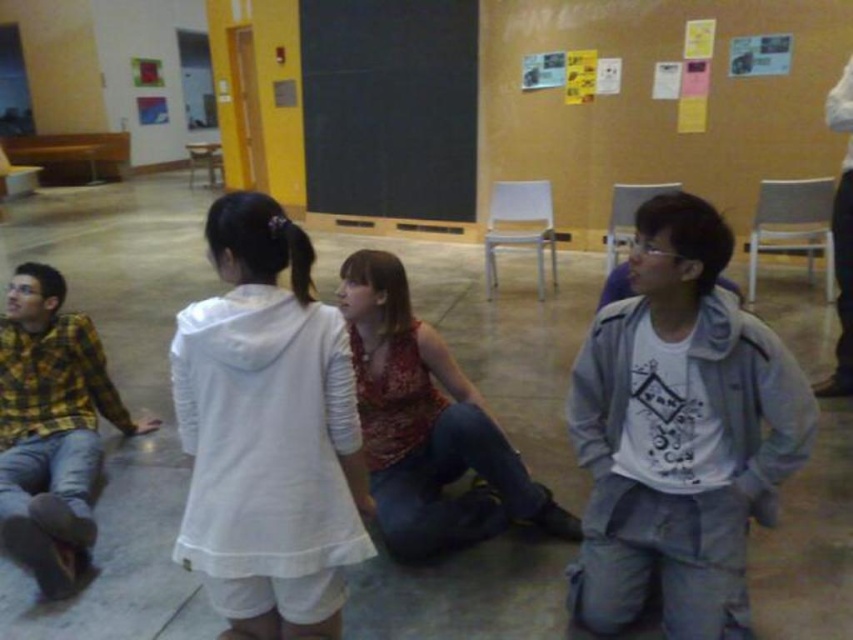
You are a photographer trying to capture a candid shot of the printed fabric tank top at center without the yellow plaid shirt at left blocking the view. Can you move closer to the subject to avoid the obstruction?

The yellow plaid shirt at left is behind the printed fabric tank top at center, so moving closer to the printed fabric tank top at center would not eliminate the obstruction since the yellow plaid shirt at left is already behind it and not in front.

Consider the image. You are standing in the classroom and want to hand a note to the person wearing the gray matte jacket at right and the printed fabric tank top at center. Which one can you reach without moving closer?

The gray matte jacket at right is closer to the viewer than the printed fabric tank top at center, so you can reach the person wearing the gray matte jacket at right without moving closer.

You are organizing a clothing donation drive and need to determine which piece of clothing is wider to decide storage space. Which item is wider between the printed fabric tank top at center and the yellow plaid shirt at left?

The printed fabric tank top at center is wider than the yellow plaid shirt at left according to the description.